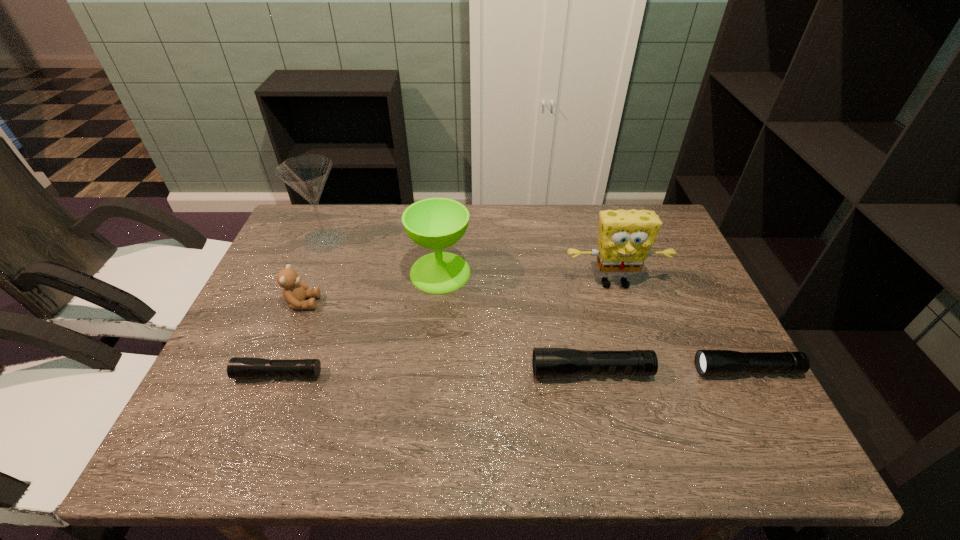
Image resolution: width=960 pixels, height=540 pixels. I want to click on flashlight located in the left edge section of the desktop, so click(238, 367).

What are the coordinates of `flute glass that is at the left edge` in the screenshot? It's located at (307, 174).

Identify the location of teddy bear located at the left edge. The height and width of the screenshot is (540, 960). (295, 292).

Find the location of `flashlight present at the right edge`. flashlight present at the right edge is located at coordinates (708, 362).

Locate an element on the screen. This screenshot has width=960, height=540. sponge situated at the right edge is located at coordinates (625, 239).

You are a GUI agent. You are given a task and a screenshot of the screen. Output one action in this format:
    pyautogui.click(x=<x>, y=<y>)
    Task: Click on the object at the far left corner
    
    Given the screenshot: What is the action you would take?
    pyautogui.click(x=307, y=174)

Locate an element on the screen. object that is at the near left corner is located at coordinates (238, 367).

You are a GUI agent. You are given a task and a screenshot of the screen. Output one action in this format:
    pyautogui.click(x=<x>, y=<y>)
    Task: Click on the object at the near right corner
    Image resolution: width=960 pixels, height=540 pixels.
    Given the screenshot: What is the action you would take?
    pyautogui.click(x=708, y=362)

This screenshot has width=960, height=540. In the image, there is a desktop. Identify the location of blank space at the far edge. (512, 237).

The height and width of the screenshot is (540, 960). In order to click on vacant space at the near edge in this screenshot , I will do `click(392, 388)`.